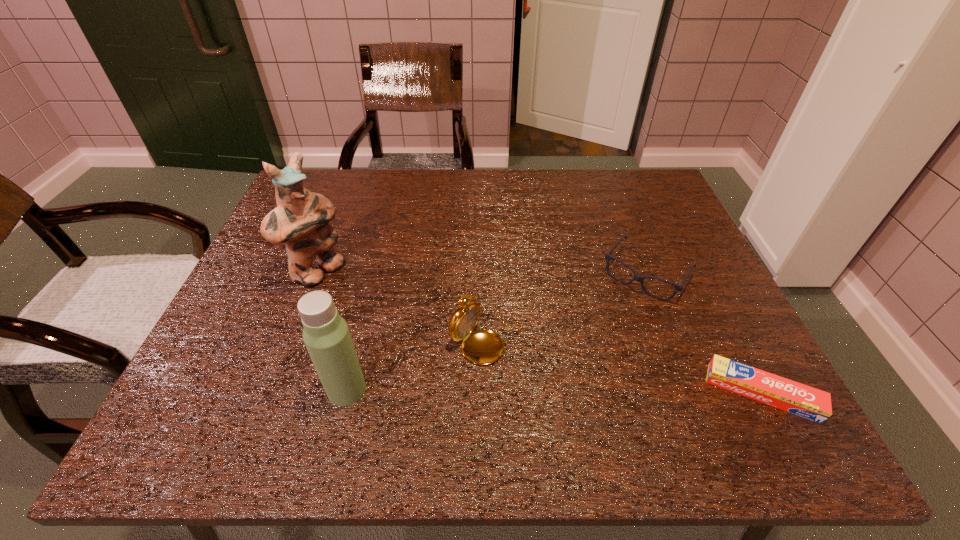
Locate an element on the screen. This screenshot has width=960, height=540. free space at the near right corner of the desktop is located at coordinates (692, 397).

Identify the location of vacant point located between the third object from right to left and the thermos bottle. (416, 362).

You are a GUI agent. You are given a task and a screenshot of the screen. Output one action in this format:
    pyautogui.click(x=<x>, y=<y>)
    Task: Click on the free area in between the shortest object and the pocket watch
    This screenshot has height=540, width=960.
    Given the screenshot: What is the action you would take?
    pyautogui.click(x=624, y=364)

The width and height of the screenshot is (960, 540). Find the location of `vacant space that's between the pocket watch and the figurine`. vacant space that's between the pocket watch and the figurine is located at coordinates (401, 304).

This screenshot has width=960, height=540. What are the coordinates of `vacant area that lies between the spectacles and the tallest object` in the screenshot? It's located at (482, 273).

You are a GUI agent. You are given a task and a screenshot of the screen. Output one action in this format:
    pyautogui.click(x=<x>, y=<y>)
    Task: Click on the vacant region between the second shortest object and the figurine
    
    Given the screenshot: What is the action you would take?
    pyautogui.click(x=482, y=273)

Where is `blank region between the figurine and the third object from right to left`? The height and width of the screenshot is (540, 960). blank region between the figurine and the third object from right to left is located at coordinates (401, 304).

This screenshot has width=960, height=540. Find the location of `free space between the fourth tallest object and the shortest object`. free space between the fourth tallest object and the shortest object is located at coordinates (705, 333).

The image size is (960, 540). Find the location of `free space between the spectacles and the pocket watch`. free space between the spectacles and the pocket watch is located at coordinates (566, 304).

Image resolution: width=960 pixels, height=540 pixels. Find the location of `object that stands as the fourth closest to the figurine`. object that stands as the fourth closest to the figurine is located at coordinates (779, 392).